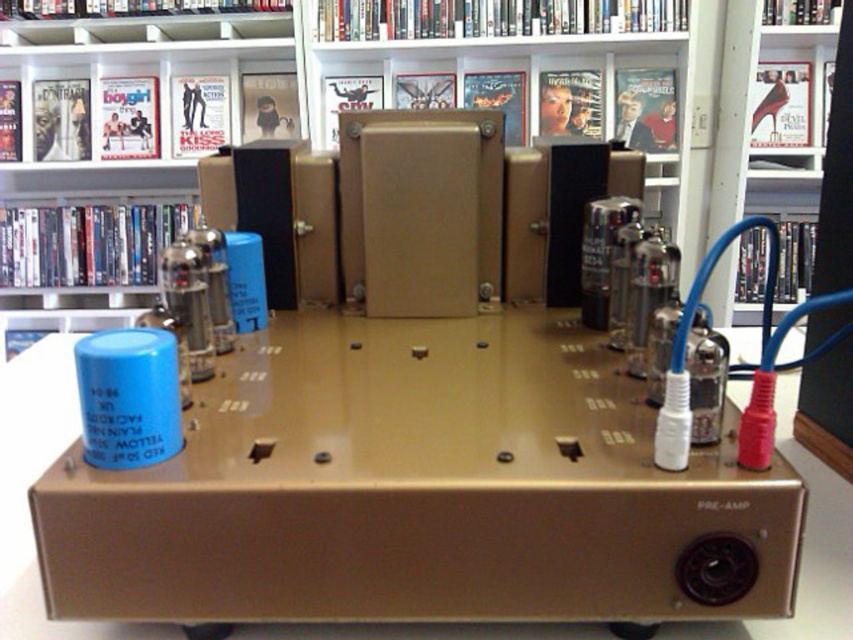
Question: From the image, what is the correct spatial relationship of metallic gold speaker at center in relation to gold metallic speaker at upper center?

Choices:
 (A) right
 (B) left

Answer: (B)

Question: Which point is farther from the camera taking this photo?

Choices:
 (A) (834, 221)
 (B) (390, 36)
 (C) (32, 124)
 (D) (846, 554)

Answer: (C)

Question: Which point is closer to the camera?

Choices:
 (A) metallic gold speaker at center
 (B) gold metallic table at center

Answer: (B)

Question: Observing the image, what is the correct spatial positioning of metallic gold speaker at center in reference to matte black bookshelf at upper center?

Choices:
 (A) below
 (B) above

Answer: (B)

Question: Which of the following is the closest to the observer?

Choices:
 (A) pyautogui.click(x=669, y=186)
 (B) pyautogui.click(x=850, y=72)

Answer: (B)

Question: Does metallic gold speaker at center have a greater width compared to gold metallic speaker at upper center?

Choices:
 (A) yes
 (B) no

Answer: (A)